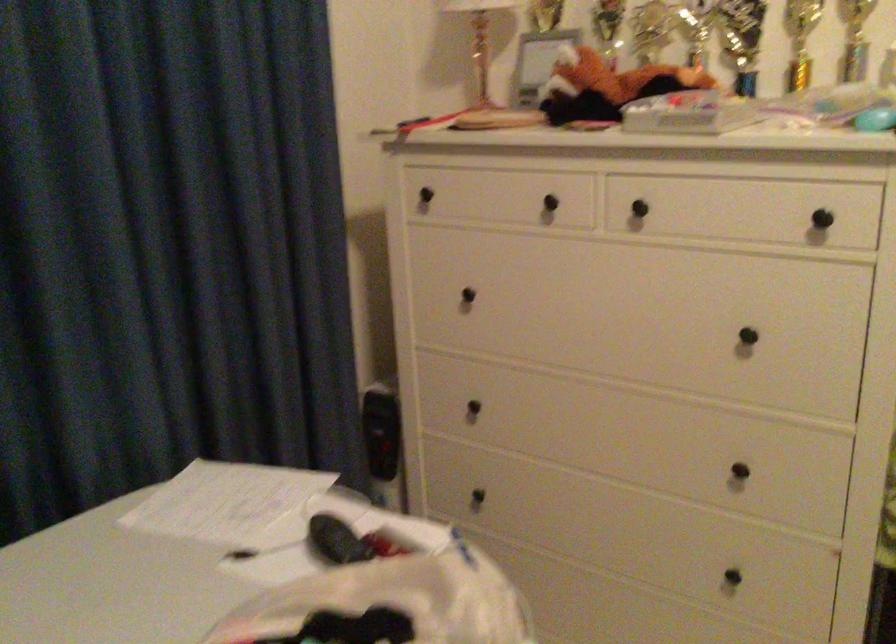
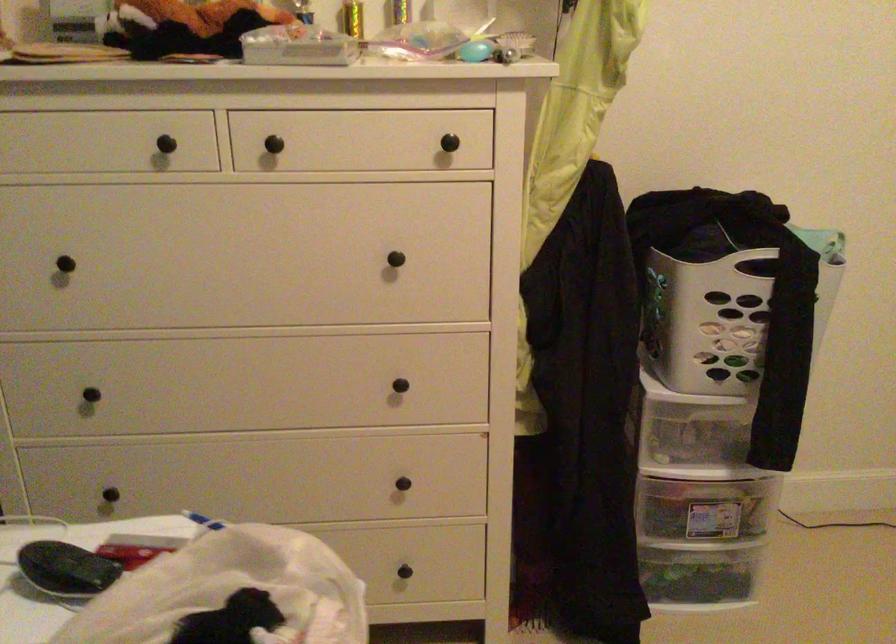
Locate, in the second image, the point that corresponds to [633,205] in the first image.

(261, 140)